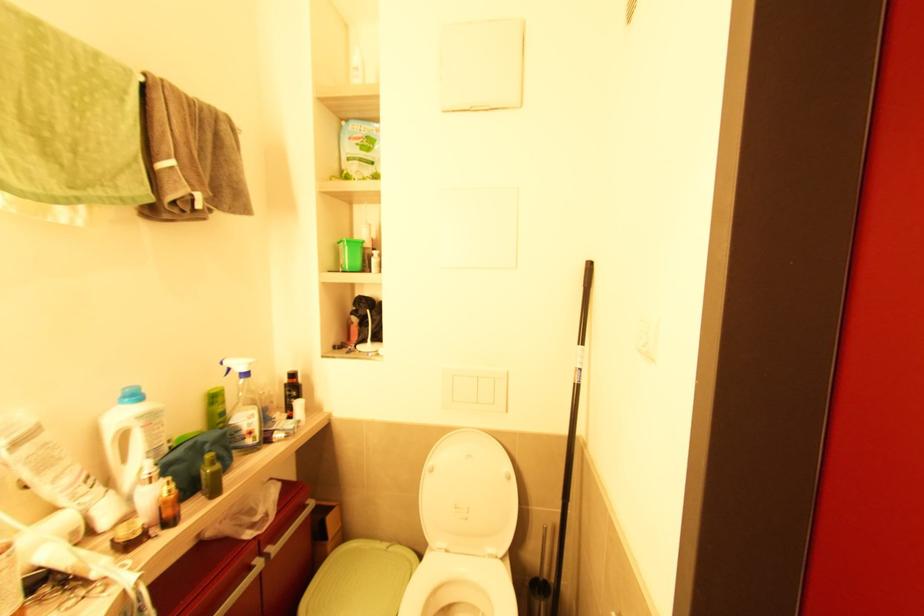
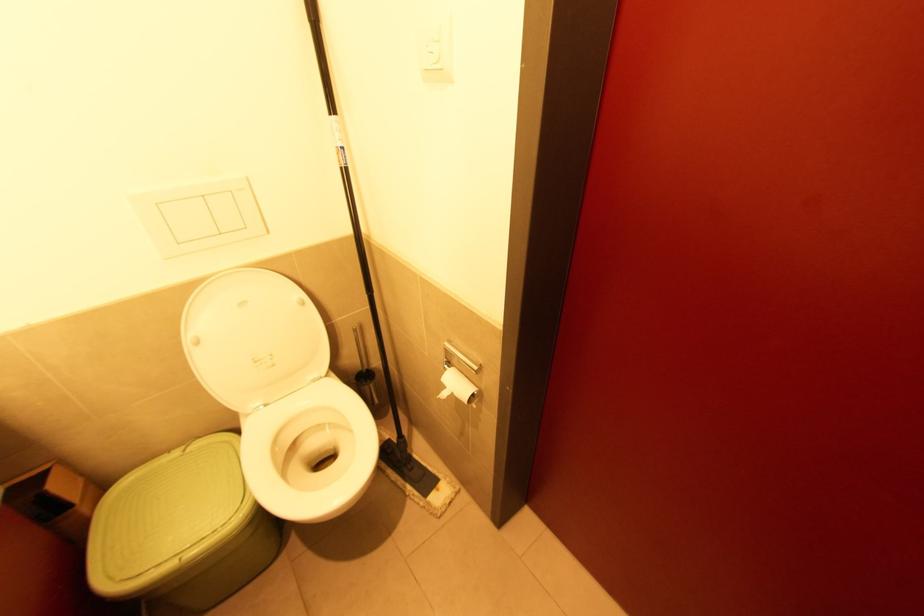
Locate, in the second image, the point that corresponds to the point at 388,549 in the first image.

(187, 452)